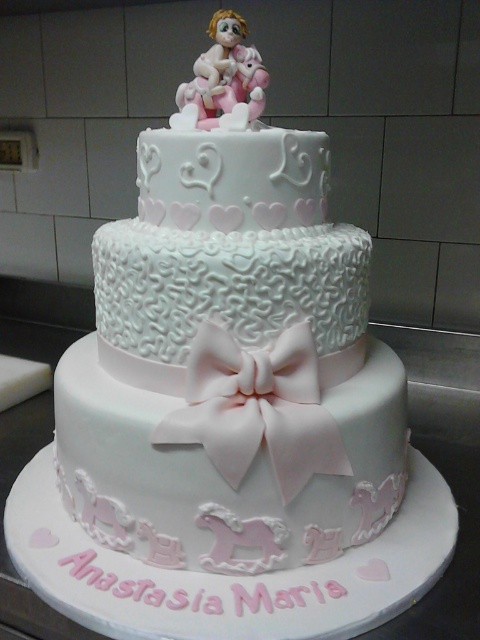
Does point (229, 369) come in front of point (218, 84)?

Yes, point (229, 369) is closer to viewer.

Who is lower down, pink satin bow at center or pink porcelain figurine at top?

Result: pink satin bow at center

You are a GUI agent. You are given a task and a screenshot of the screen. Output one action in this format:
    pyautogui.click(x=<x>, y=<y>)
    Task: Click on the pink satin bow at center
    This screenshot has width=480, height=640.
    Given the screenshot: What is the action you would take?
    pyautogui.click(x=256, y=408)